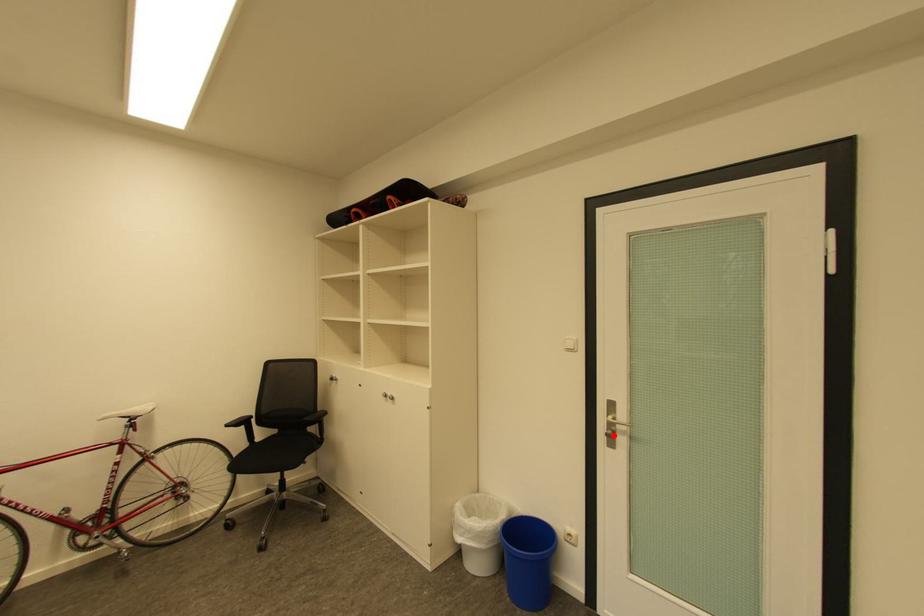
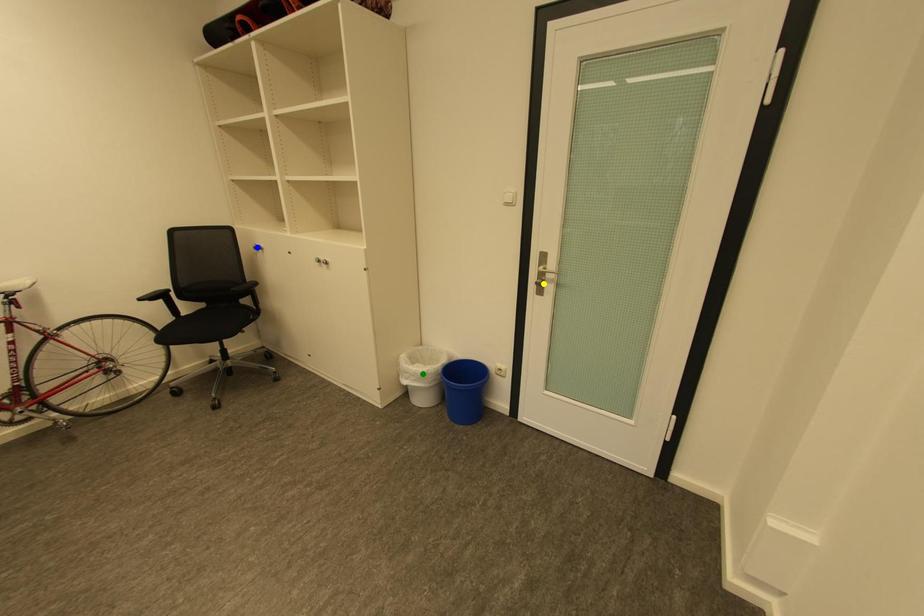
Question: I am providing you with two images of the same scene from different viewpoints. A red point is marked on the first image. You are given multiple points on the second image. Can you choose the point in image 2 that corresponds to the point in image 1?

Choices:
 (A) green point
 (B) blue point
 (C) yellow point

Answer: (C)